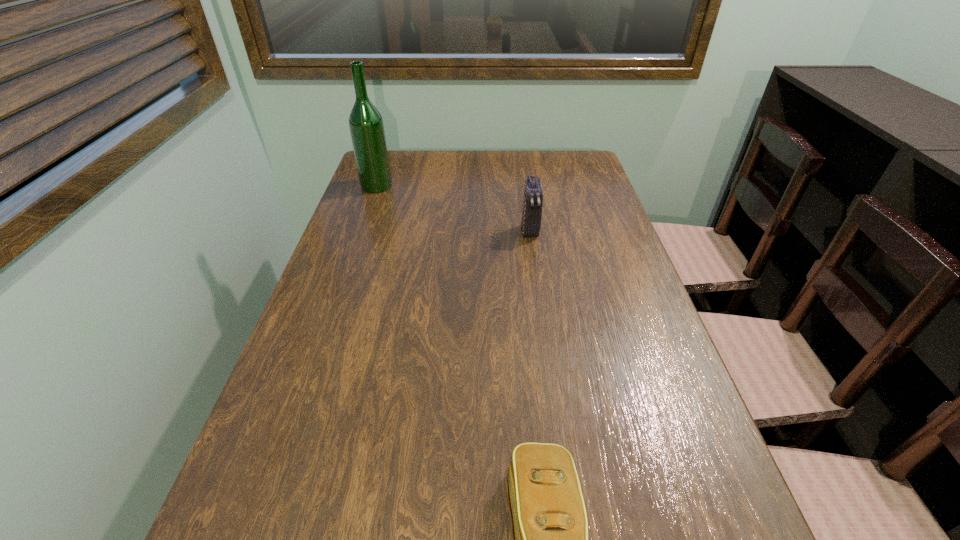
The image size is (960, 540). I want to click on the farthest object, so click(x=366, y=125).

Locate an element on the screen. This screenshot has width=960, height=540. the leftmost object is located at coordinates (366, 125).

You are a GUI agent. You are given a task and a screenshot of the screen. Output one action in this format:
    pyautogui.click(x=<x>, y=<y>)
    Task: Click on the second tallest object
    The height and width of the screenshot is (540, 960).
    Given the screenshot: What is the action you would take?
    pyautogui.click(x=533, y=194)

Locate an element on the screen. The height and width of the screenshot is (540, 960). the farther clutch bag is located at coordinates (533, 194).

Locate an element on the screen. The image size is (960, 540). vacant area located on the right of the alcohol is located at coordinates (453, 186).

You are a GUI agent. You are given a task and a screenshot of the screen. Output one action in this format:
    pyautogui.click(x=<x>, y=<y>)
    Task: Click on the vacant space located 0.370m with the zip open on the taller clutch bag
    
    Given the screenshot: What is the action you would take?
    pyautogui.click(x=547, y=352)

Identify the location of object at the far edge. This screenshot has height=540, width=960. (366, 125).

At what (x,y) coordinates should I click in order to perform the action: click on object that is at the left edge. Please return your answer as a coordinate pair (x, y). The width and height of the screenshot is (960, 540). Looking at the image, I should click on (366, 125).

This screenshot has width=960, height=540. I want to click on object located in the far left corner section of the desktop, so click(x=366, y=125).

At what (x,y) coordinates should I click in order to perform the action: click on free space at the far edge of the desktop. Please return your answer as a coordinate pair (x, y). The width and height of the screenshot is (960, 540). Looking at the image, I should click on (536, 167).